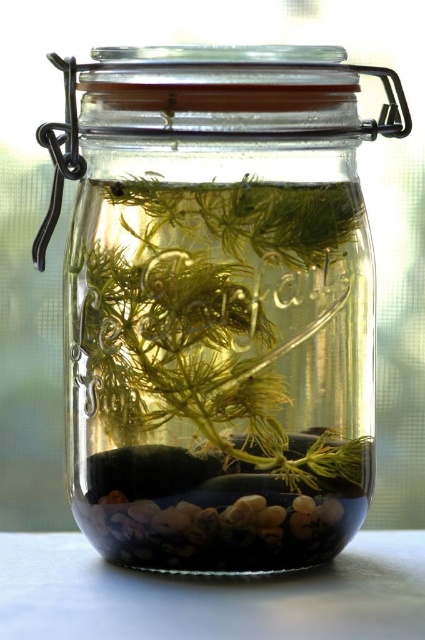
Looking at this image, you have a small decorative item that needs to fit into a storage box. The storage box can only accommodate items up to the width of the translucent green plant at center. Can the clear glass jar at center fit into the storage box?

The clear glass jar at center is wider than the translucent green plant at center, so it cannot fit into the storage box designed for items up to the plant width.

You are arranging items on a table and want to place a decorative item closer to you. Which object between the clear glass jar at center and the white glossy table at lower center should you choose?

The clear glass jar at center is further to the viewer than the white glossy table at lower center, so you should choose the clear glass jar at center to place closer to you.

You are arranging a centerpiece for a dinner party. You have a translucent green plant at center and a white glossy table at lower center. Which object is bigger in size?

The translucent green plant at center is larger in size compared to the white glossy table at lower center according to the description.